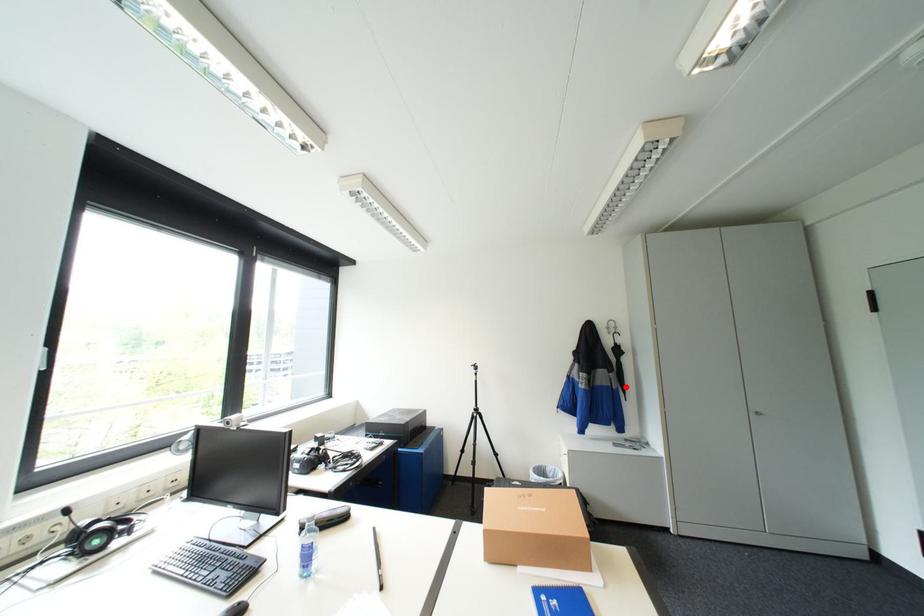
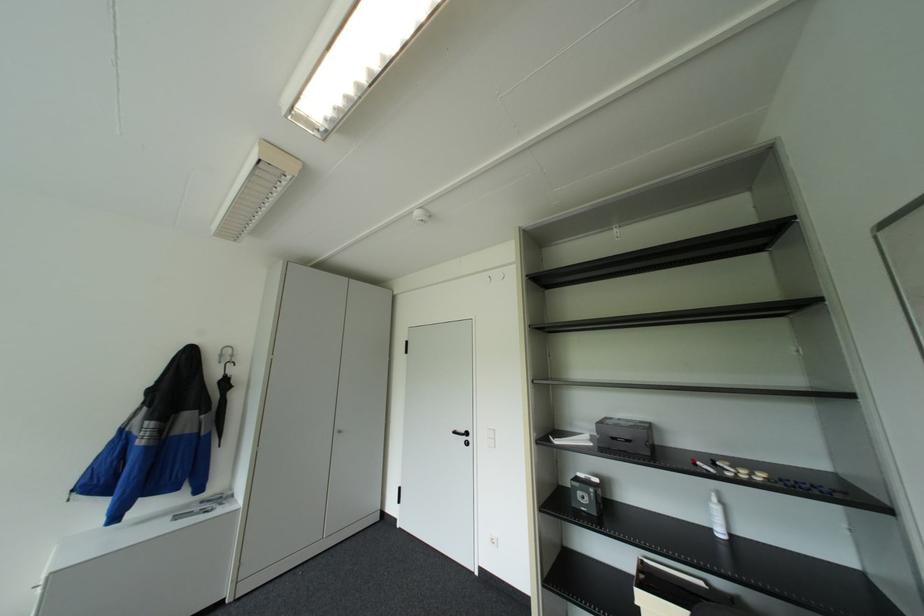
The point at the highlighted location is marked in the first image. Where is the corresponding point in the second image?

(217, 432)